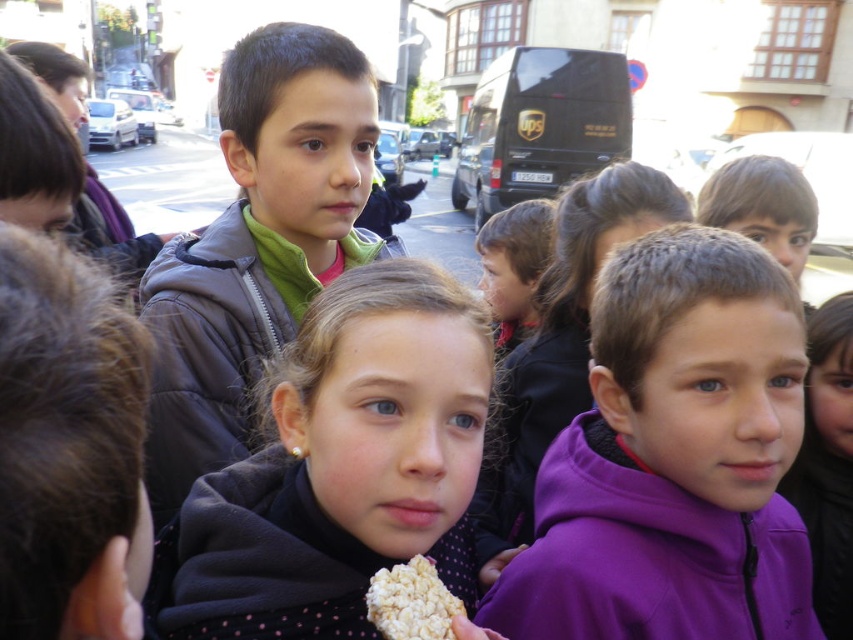
Between purple fleece jacket at center and dark gray fleece jacket at center, which one appears on the right side from the viewer's perspective?

Positioned to the right is purple fleece jacket at center.

Is purple fleece jacket at center taller than dark gray fleece jacket at center?

Yes, purple fleece jacket at center is taller than dark gray fleece jacket at center.

You are a GUI agent. You are given a task and a screenshot of the screen. Output one action in this format:
    pyautogui.click(x=<x>, y=<y>)
    Task: Click on the purple fleece jacket at center
    
    Given the screenshot: What is the action you would take?
    pyautogui.click(x=674, y=460)

I want to click on purple fleece jacket at center, so click(x=674, y=460).

Which is more to the left, dark gray fleece jacket at center or white crumbly snack at center?

dark gray fleece jacket at center is more to the left.

At what (x,y) coordinates should I click in order to perform the action: click on dark gray fleece jacket at center. Please return your answer as a coordinate pair (x, y). Looking at the image, I should click on (340, 468).

Does matte gray jacket at center lie in front of white crumbly snack at center?

That is False.

Does matte gray jacket at center have a greater height compared to white crumbly snack at center?

Correct, matte gray jacket at center is much taller as white crumbly snack at center.

Is point (223, 125) closer to camera compared to point (425, 611)?

No.

Where is `matte gray jacket at center`? The image size is (853, 640). matte gray jacket at center is located at coordinates (257, 244).